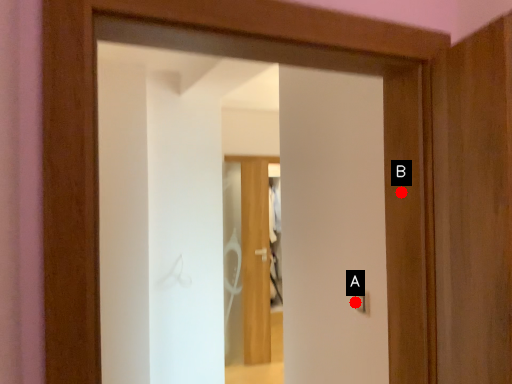
Question: Two points are circled on the image, labeled by A and B beside each circle. Which point is closer to the camera?

Choices:
 (A) A is closer
 (B) B is closer

Answer: (B)